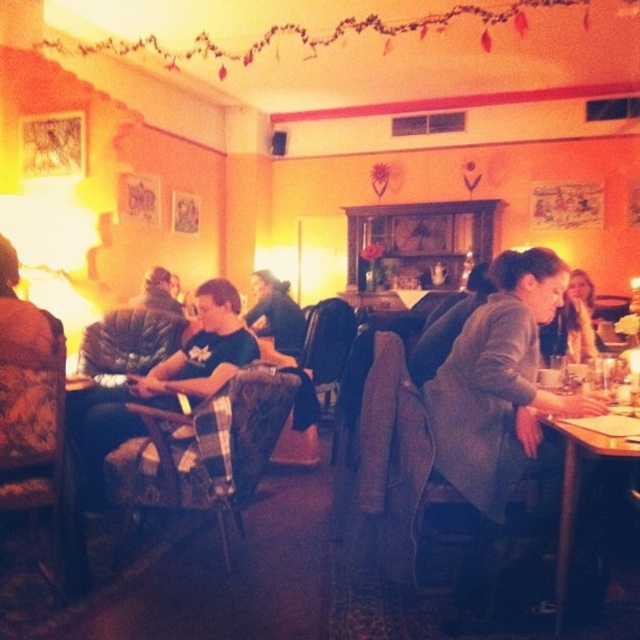
Which of these two, black cotton shirt at center or dark brown leather jacket at center, stands shorter?

dark brown leather jacket at center is shorter.

Between black cotton shirt at center and dark brown leather jacket at center, which one is positioned higher?

dark brown leather jacket at center is above.

What do you see at coordinates (164, 381) in the screenshot? The width and height of the screenshot is (640, 640). I see `black cotton shirt at center` at bounding box center [164, 381].

Where is `black cotton shirt at center`? black cotton shirt at center is located at coordinates 164,381.

Is point (291, 355) positioned before point (131, 301)?

That is False.

Does black matte shirt at center appear under dark brown leather jacket at center?

Correct, black matte shirt at center is located below dark brown leather jacket at center.

Which is in front, point (300, 314) or point (154, 289)?

Point (154, 289)

I want to click on black matte shirt at center, so click(x=275, y=314).

Which is above, black cotton shirt at center or wooden table at lower right?

black cotton shirt at center

Is black cotton shirt at center taller than wooden table at lower right?

Indeed, black cotton shirt at center has a greater height compared to wooden table at lower right.

Locate an element on the screen. black cotton shirt at center is located at coordinates (164, 381).

Locate an element on the screen. The image size is (640, 640). black cotton shirt at center is located at coordinates (164, 381).